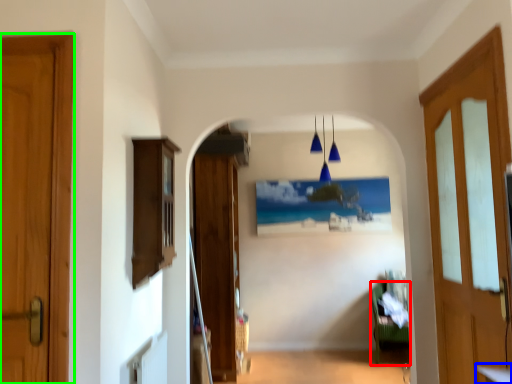
Question: Considering the real-world distances, which object is farthest from furniture (highlighted by a red box)? table (highlighted by a blue box) or door (highlighted by a green box)?

Choices:
 (A) table
 (B) door

Answer: (B)